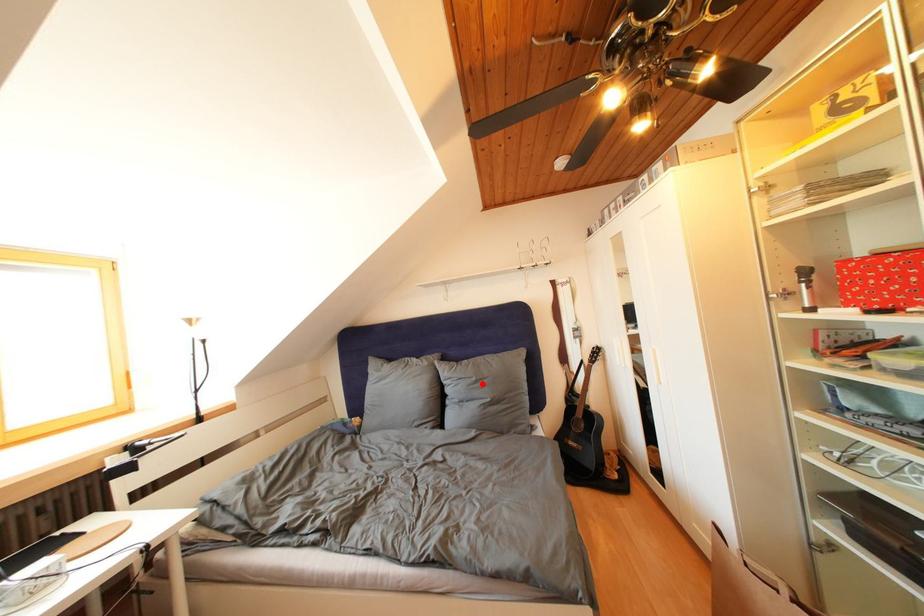
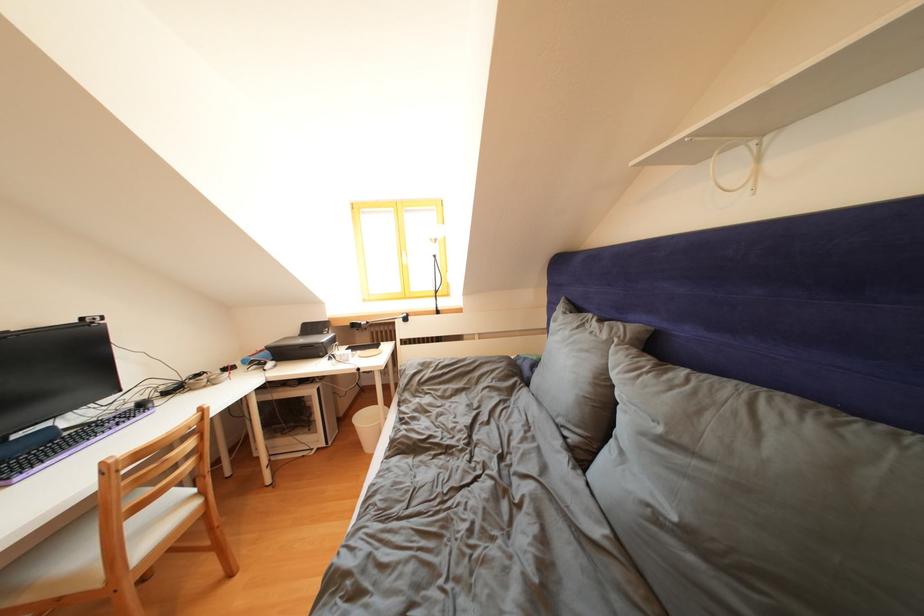
Question: I am providing you with two images of the same scene from different viewpoints. In image1, a red point is highlighted. Considering the same 3D point in image2, which of the following is correct?

Choices:
 (A) It is closer
 (B) It is farther

Answer: (A)